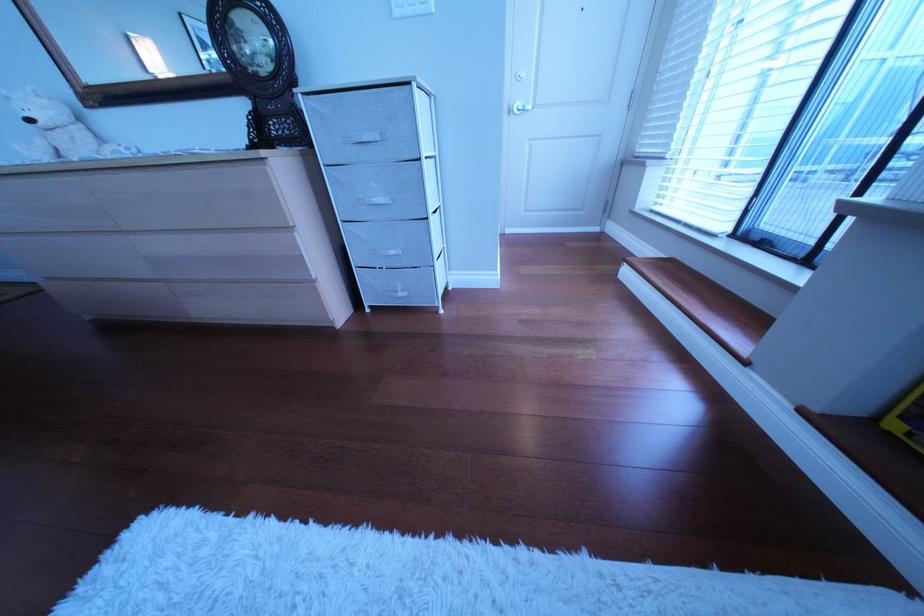
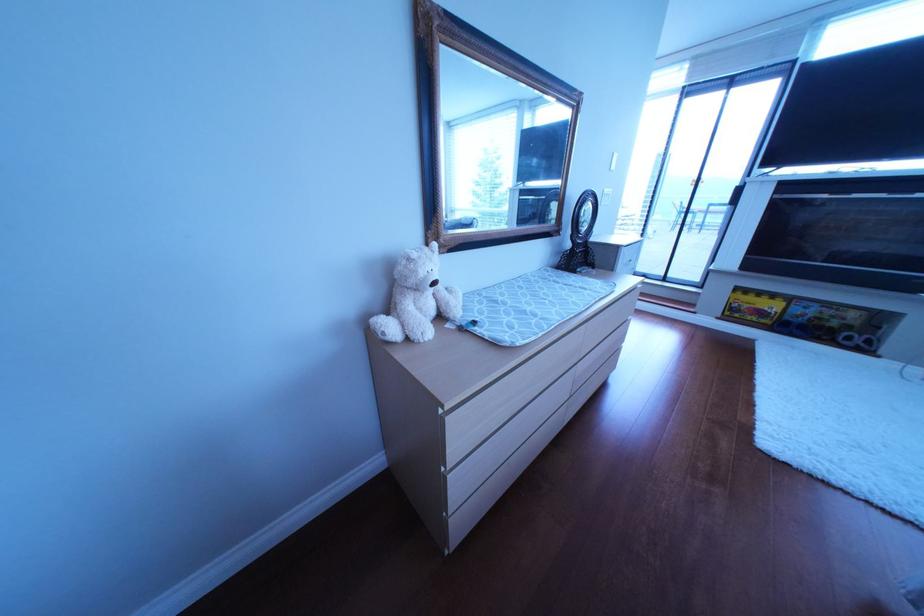
The point at (817, 413) is marked in the first image. Where is the corresponding point in the second image?

(733, 320)